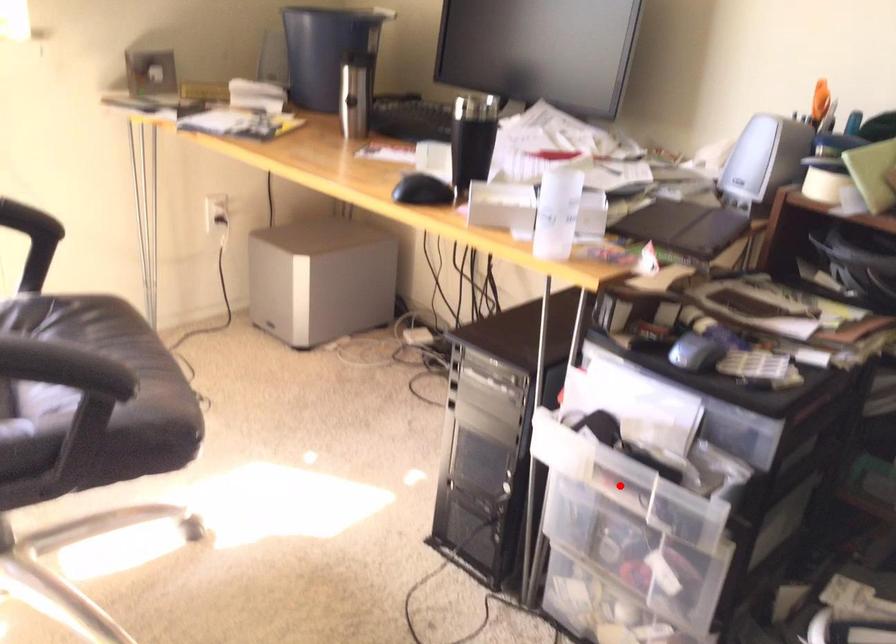
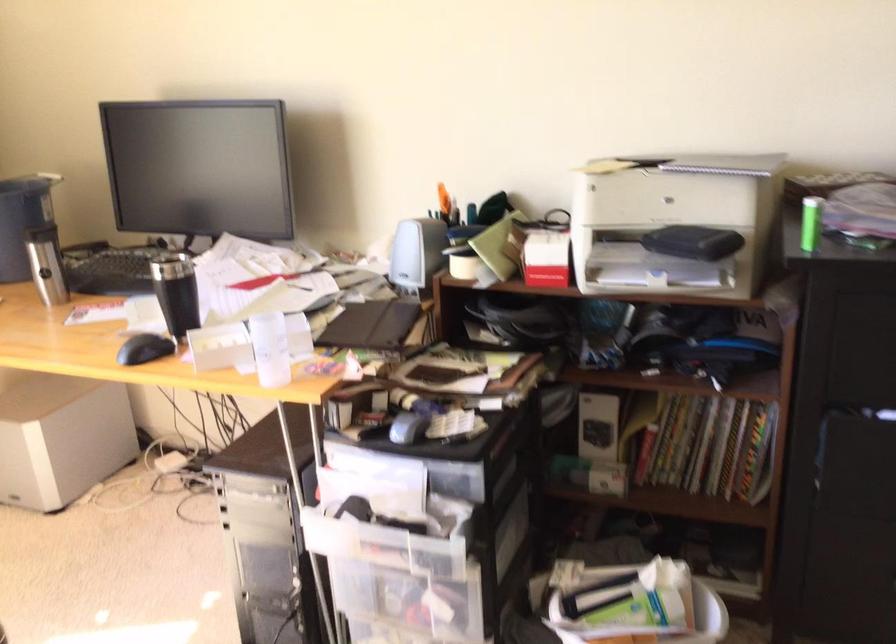
Question: I am providing you with two images of the same scene from different viewpoints. Image1 has a red point marked. In image2, the corresponding 3D location appears at what relative position? Reply with the corresponding letter.

Choices:
 (A) Closer
 (B) Farther

Answer: (B)